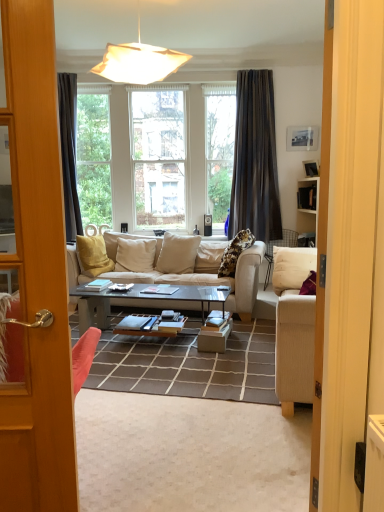
Image resolution: width=384 pixels, height=512 pixels. In order to click on beige fabric couch at center in this screenshot , I will do `click(210, 280)`.

You are a GUI agent. You are given a task and a screenshot of the screen. Output one action in this format:
    pyautogui.click(x=<x>, y=<y>)
    Task: Click on the matte white pendant light at upper center
    The image size is (384, 512).
    Given the screenshot: What is the action you would take?
    pyautogui.click(x=139, y=62)

From the image's perspective, is matte white pendant light at upper center beneath shiny black glass coffee table at center?

Actually, matte white pendant light at upper center appears above shiny black glass coffee table at center in the image.

Is matte white pendant light at upper center looking in the opposite direction of shiny black glass coffee table at center?

No.

Based on the photo, from a real-world perspective, does matte white pendant light at upper center sit lower than shiny black glass coffee table at center?

No, from a real-world perspective, matte white pendant light at upper center is not under shiny black glass coffee table at center.

Between beige fabric couch at center and shiny black glass coffee table at center, which one has smaller size?

With smaller size is shiny black glass coffee table at center.

Which is more to the right, beige fabric couch at center or shiny black glass coffee table at center?

beige fabric couch at center is more to the right.

Find the location of a particular element. The image size is (384, 512). coffee table located on the left of beige fabric couch at center is located at coordinates (142, 301).

Is beige fabric couch at center wider or thinner than shiny black glass coffee table at center?

In the image, beige fabric couch at center appears to be wider than shiny black glass coffee table at center.

Which is less distant, (182, 280) or (245, 149)?

Point (182, 280) appears to be closer to the viewer than point (245, 149).

Is beige fabric couch at center aimed at dark gray fabric curtain at upper center?

No, beige fabric couch at center is not oriented towards dark gray fabric curtain at upper center.

Does beige fabric couch at center have a larger size compared to dark gray fabric curtain at upper center?

Indeed, beige fabric couch at center has a larger size compared to dark gray fabric curtain at upper center.

Which object is positioned more to the left, dark gray fabric curtain at upper center or shiny black glass coffee table at center?

shiny black glass coffee table at center.

From the picture: Considering the sizes of objects dark gray fabric curtain at upper center and shiny black glass coffee table at center in the image provided, who is bigger, dark gray fabric curtain at upper center or shiny black glass coffee table at center?

Bigger between the two is dark gray fabric curtain at upper center.

Is dark gray fabric curtain at upper center placed right next to shiny black glass coffee table at center?

There is a gap between dark gray fabric curtain at upper center and shiny black glass coffee table at center.

Is dark gray fabric curtain at upper center spatially inside shiny black glass coffee table at center, or outside of it?

dark gray fabric curtain at upper center cannot be found inside shiny black glass coffee table at center.

Looking at the image, does shiny black glass coffee table at center seem bigger or smaller compared to matte white pendant light at upper center?

Considering their sizes, shiny black glass coffee table at center takes up less space than matte white pendant light at upper center.

Considering the relative positions of shiny black glass coffee table at center and matte white pendant light at upper center in the image provided, is shiny black glass coffee table at center to the right of matte white pendant light at upper center from the viewer's perspective?

Yes.

Consider the image. Looking at their sizes, would you say shiny black glass coffee table at center is wider or thinner than matte white pendant light at upper center?

shiny black glass coffee table at center is thinner than matte white pendant light at upper center.

From a real-world perspective, is shiny black glass coffee table at center above or below matte white pendant light at upper center?

In terms of real-world spatial position, shiny black glass coffee table at center is below matte white pendant light at upper center.

Considering the positions of point (107, 67) and point (130, 275), is point (107, 67) closer or farther from the camera than point (130, 275)?

Point (107, 67) appears to be closer to the viewer than point (130, 275).

Is beige fabric couch at center at the back of matte white pendant light at upper center?

No, beige fabric couch at center is not at the back of matte white pendant light at upper center.

Can you tell me how much matte white pendant light at upper center and beige fabric couch at center differ in facing direction?

The facing directions of matte white pendant light at upper center and beige fabric couch at center are 12.1 degrees apart.

Measure the distance between matte white pendant light at upper center and beige fabric couch at center.

matte white pendant light at upper center and beige fabric couch at center are 6.05 feet apart from each other.

From a real-world perspective, which object rests below the other?

shiny black glass coffee table at center is physically lower.

Can we say shiny black glass coffee table at center lies outside beige fabric couch at center?

Yes.

Does shiny black glass coffee table at center have a greater width compared to beige fabric couch at center?

No.

Is shiny black glass coffee table at center next to beige fabric couch at center and touching it?

No, shiny black glass coffee table at center is not touching beige fabric couch at center.

Locate an element on the screen. This screenshot has height=512, width=384. lamp located in front of the shiny black glass coffee table at center is located at coordinates (139, 62).

The height and width of the screenshot is (512, 384). In order to click on coffee table beneath the beige fabric couch at center (from a real-world perspective) in this screenshot , I will do click(142, 301).

Considering their positions, is shiny black glass coffee table at center positioned closer to matte white pendant light at upper center than dark gray fabric curtain at upper center?

Based on the image, shiny black glass coffee table at center appears to be nearer to matte white pendant light at upper center.

When comparing their distances from beige fabric couch at center, does matte white pendant light at upper center or shiny black glass coffee table at center seem closer?

Among the two, shiny black glass coffee table at center is located nearer to beige fabric couch at center.

Consider the image. Based on their spatial positions, is shiny black glass coffee table at center or dark gray fabric curtain at upper center further from beige fabric couch at center?

dark gray fabric curtain at upper center is further to beige fabric couch at center.

Considering their positions, is matte white pendant light at upper center positioned closer to shiny black glass coffee table at center than dark gray fabric curtain at upper center?

matte white pendant light at upper center lies closer to shiny black glass coffee table at center than the other object.

Considering their positions, is shiny black glass coffee table at center positioned closer to beige fabric couch at center than matte white pendant light at upper center?

shiny black glass coffee table at center lies closer to beige fabric couch at center than the other object.

Which object lies further to the anchor point matte white pendant light at upper center, shiny black glass coffee table at center or beige fabric couch at center?

shiny black glass coffee table at center is further to matte white pendant light at upper center.

From the image, which object appears to be nearer to matte white pendant light at upper center, dark gray fabric curtain at upper center or beige fabric couch at center?

beige fabric couch at center is positioned closer to the anchor matte white pendant light at upper center.

Based on their spatial positions, is dark gray fabric curtain at upper center or shiny black glass coffee table at center closer to matte white pendant light at upper center?

shiny black glass coffee table at center is positioned closer to the anchor matte white pendant light at upper center.

What are the coordinates of `studio couch that lies between matte white pendant light at upper center and shiny black glass coffee table at center from top to bottom` in the screenshot? It's located at (210, 280).

Where is `studio couch positioned between matte white pendant light at upper center and dark gray fabric curtain at upper center from near to far`? The height and width of the screenshot is (512, 384). studio couch positioned between matte white pendant light at upper center and dark gray fabric curtain at upper center from near to far is located at coordinates (210, 280).

Where is `coffee table positioned between matte white pendant light at upper center and dark gray fabric curtain at upper center from near to far`? The height and width of the screenshot is (512, 384). coffee table positioned between matte white pendant light at upper center and dark gray fabric curtain at upper center from near to far is located at coordinates (142, 301).

The height and width of the screenshot is (512, 384). Identify the location of studio couch between dark gray fabric curtain at upper center and shiny black glass coffee table at center vertically. [x=210, y=280].